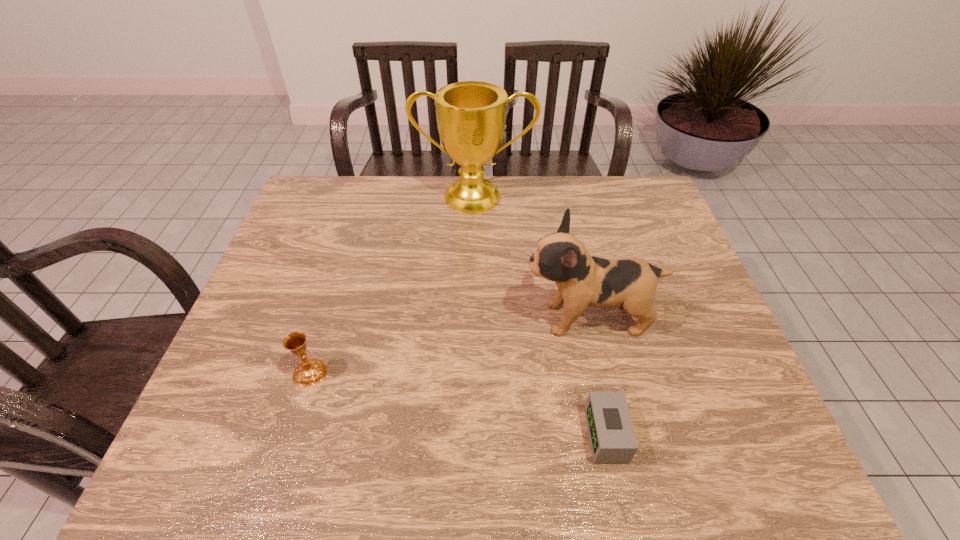
Identify the location of vacant area between the shortest object and the chalice. (458, 404).

Where is `vacant space in between the leftmost object and the tallest object`? vacant space in between the leftmost object and the tallest object is located at coordinates (393, 285).

At what (x,y) coordinates should I click in order to perform the action: click on free space between the second shortest object and the farthest object. Please return your answer as a coordinate pair (x, y). Looking at the image, I should click on (393, 285).

The image size is (960, 540). In order to click on free space between the third farthest object and the puppy in this screenshot , I will do `click(449, 346)`.

The width and height of the screenshot is (960, 540). Identify the location of object identified as the closest to the third shortest object. (612, 438).

Identify the location of the third closest object relative to the shortest object. Image resolution: width=960 pixels, height=540 pixels. (471, 115).